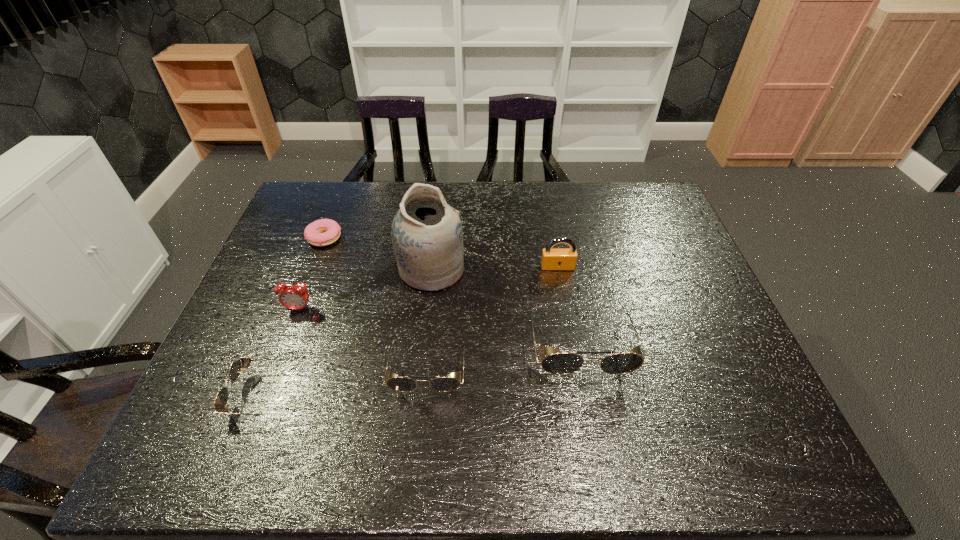
Image resolution: width=960 pixels, height=540 pixels. What are the coordinates of `vacant space located on the front lenses of the leftmost sunglasses` in the screenshot? It's located at (209, 395).

Image resolution: width=960 pixels, height=540 pixels. I want to click on vacant space situated 0.070m on the front lenses of the tallest sunglasses, so click(x=591, y=411).

Where is `vacant space situated 0.310m on the right of the shortest object`? vacant space situated 0.310m on the right of the shortest object is located at coordinates (441, 238).

The image size is (960, 540). Find the location of `vacant space situated 0.290m on the face of the alarm clock`. vacant space situated 0.290m on the face of the alarm clock is located at coordinates (258, 415).

I want to click on free point located to unlock the padlock from the front, so click(572, 347).

Locate an element on the screen. vacant space situated on the left of the pottery is located at coordinates (299, 269).

You are a GUI agent. You are given a task and a screenshot of the screen. Output one action in this format:
    pyautogui.click(x=<x>, y=<y>)
    Task: Click on the sunglasses at the left edge
    The width and height of the screenshot is (960, 540).
    Given the screenshot: What is the action you would take?
    pyautogui.click(x=221, y=400)

Identify the location of doughnut located in the left edge section of the desktop. (323, 232).

Locate an element on the screen. The width and height of the screenshot is (960, 540). alarm clock that is at the left edge is located at coordinates (295, 297).

Locate an element on the screen. The height and width of the screenshot is (540, 960). object at the near left corner is located at coordinates (221, 400).